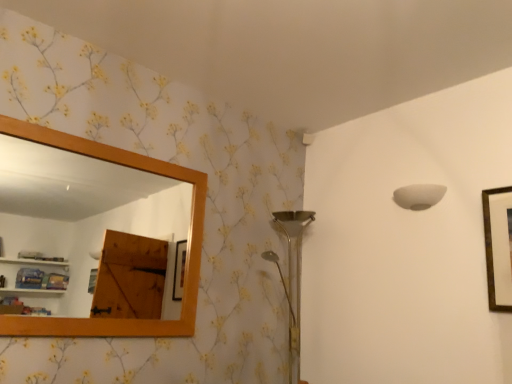
Question: From the image's perspective, is gold-framed picture at upper right positioned above or below wooden frame mirror at upper left?

Choices:
 (A) below
 (B) above

Answer: (A)

Question: Based on their sizes in the image, would you say gold-framed picture at upper right is bigger or smaller than wooden frame mirror at upper left?

Choices:
 (A) big
 (B) small

Answer: (B)

Question: Estimate the real-world distances between objects in this image. Which object is farther from the wooden frame mirror at upper left?

Choices:
 (A) white matte lampshade at upper right
 (B) gold-framed picture at upper right

Answer: (B)

Question: Considering the real-world distances, which object is closest to the white matte lampshade at upper right?

Choices:
 (A) gold-framed picture at upper right
 (B) wooden frame mirror at upper left

Answer: (A)